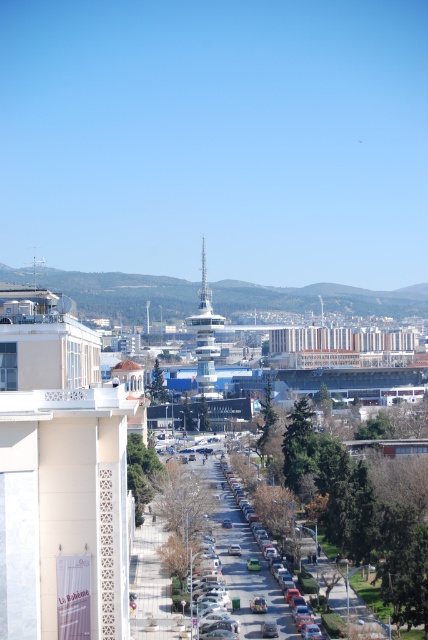
Question: Which point is farther to the camera?

Choices:
 (A) white textured balcony at center
 (B) matte silver car at center

Answer: (B)

Question: Which of the following is the closest to the observer?

Choices:
 (A) white textured balcony at center
 (B) matte silver car at center

Answer: (A)

Question: Can you confirm if white textured balcony at center is positioned to the left of matte silver car at center?

Choices:
 (A) yes
 (B) no

Answer: (A)

Question: Is white textured balcony at center thinner than matte silver car at center?

Choices:
 (A) no
 (B) yes

Answer: (A)

Question: Can you confirm if white textured balcony at center is thinner than matte silver car at center?

Choices:
 (A) no
 (B) yes

Answer: (A)